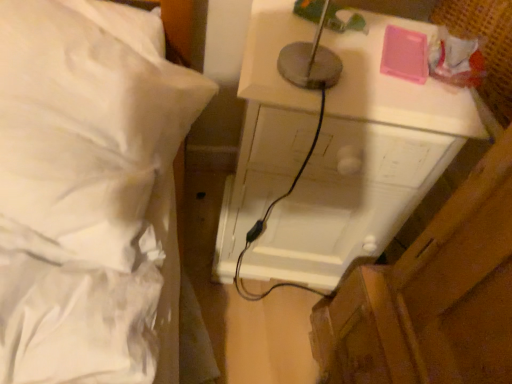
Question: In terms of width, does white glossy nightstand at upper right look wider or thinner when compared to white soft bed at upper left?

Choices:
 (A) wide
 (B) thin

Answer: (B)

Question: Is point (384, 208) positioned closer to the camera than point (60, 147)?

Choices:
 (A) farther
 (B) closer

Answer: (A)

Question: In terms of height, does white glossy nightstand at upper right look taller or shorter compared to white soft bed at upper left?

Choices:
 (A) tall
 (B) short

Answer: (A)

Question: Based on their sizes in the image, would you say white soft bed at upper left is bigger or smaller than white glossy nightstand at upper right?

Choices:
 (A) big
 (B) small

Answer: (B)

Question: Considering the relative positions of white soft bed at upper left and white glossy nightstand at upper right in the image provided, is white soft bed at upper left to the left or to the right of white glossy nightstand at upper right?

Choices:
 (A) right
 (B) left

Answer: (B)

Question: From the image's perspective, is white soft bed at upper left positioned above or below white glossy nightstand at upper right?

Choices:
 (A) below
 (B) above

Answer: (B)

Question: Considering the positions of white soft bed at upper left and white glossy nightstand at upper right in the image, is white soft bed at upper left wider or thinner than white glossy nightstand at upper right?

Choices:
 (A) thin
 (B) wide

Answer: (B)